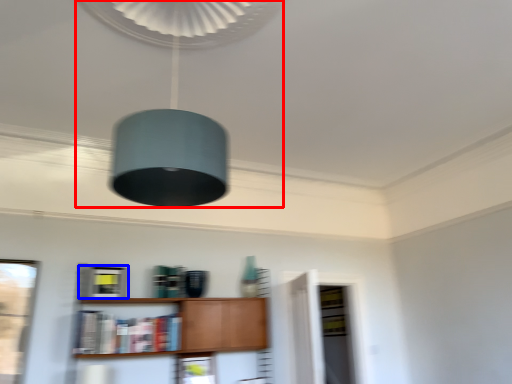
Question: Which point is closer to the camera, lamp (highlighted by a red box) or cabinetry (highlighted by a blue box)?

Choices:
 (A) lamp
 (B) cabinetry

Answer: (A)